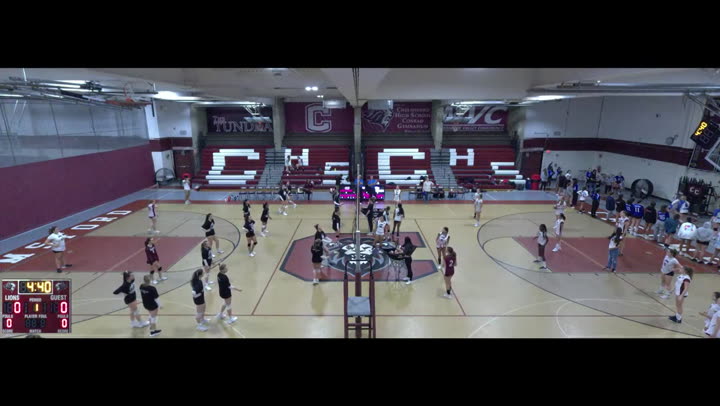
Locate an element on the screen. wall is located at coordinates (63, 188).